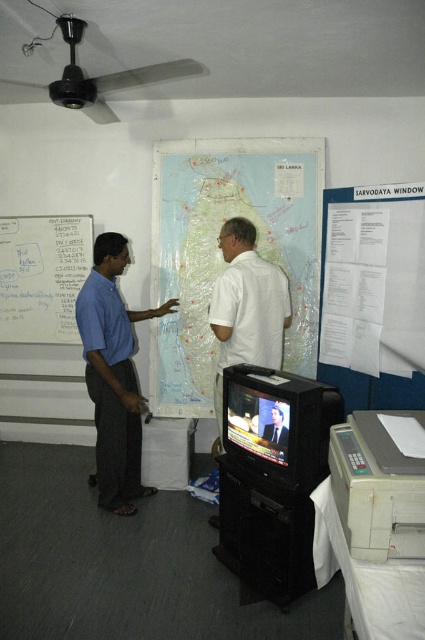
Looking at this image, you are standing in the room and want to look at the transparent plastic map at center and the smooth white shirt at center. Which object is closer to the left side of the room?

The transparent plastic map at center is to the left of the smooth white shirt at center, so the transparent plastic map at center is closer to the left side of the room.

You are organizing a presentation in the room and need to place a 1.2 meter wide screen between the transparent plastic map at center and the blue cotton shirt at left. Will the screen fit horizontally between them?

The transparent plastic map at center is wider than the blue cotton shirt at left. Since the screen is 1.2 meters wide, it depends on the actual widths of both objects. However, without specific measurements, we cannot confirm if the space between them is sufficient. Please check the exact dimensions of both objects to determine if the screen will fit.